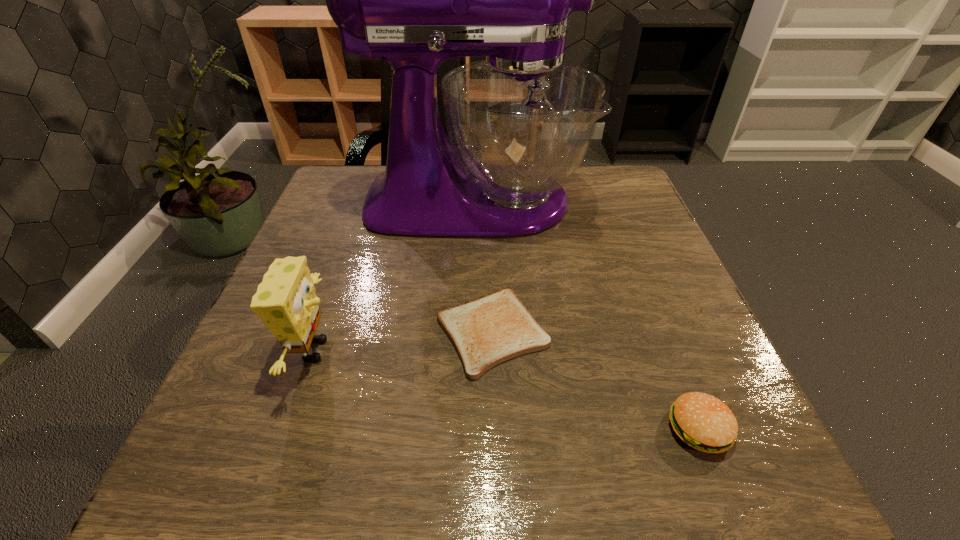
Locate an element on the screen. The width and height of the screenshot is (960, 540). vacant space at the right edge of the desktop is located at coordinates 624,221.

This screenshot has width=960, height=540. Find the location of `free region at the far left corner of the desktop`. free region at the far left corner of the desktop is located at coordinates (372, 182).

Locate an element on the screen. The height and width of the screenshot is (540, 960). vacant space at the far right corner is located at coordinates (598, 182).

I want to click on vacant space in between the second shortest object and the farthest object, so click(x=587, y=315).

The image size is (960, 540). In order to click on vacant space that is in between the sponge and the mixer in this screenshot , I will do `click(394, 276)`.

The width and height of the screenshot is (960, 540). Find the location of `vacant area between the tallest object and the rightmost object`. vacant area between the tallest object and the rightmost object is located at coordinates (587, 315).

Find the location of a particular element. The width and height of the screenshot is (960, 540). free point between the toast and the mixer is located at coordinates (483, 267).

Image resolution: width=960 pixels, height=540 pixels. Identify the location of unoccupied position between the third shortest object and the shortest object. [403, 341].

You are a GUI agent. You are given a task and a screenshot of the screen. Output one action in this format:
    pyautogui.click(x=<x>, y=<y>)
    Task: Click on the empty space between the tallest object and the shortest object
    
    Given the screenshot: What is the action you would take?
    pyautogui.click(x=483, y=267)

This screenshot has height=540, width=960. I want to click on vacant point located between the rightmost object and the mixer, so click(x=587, y=315).